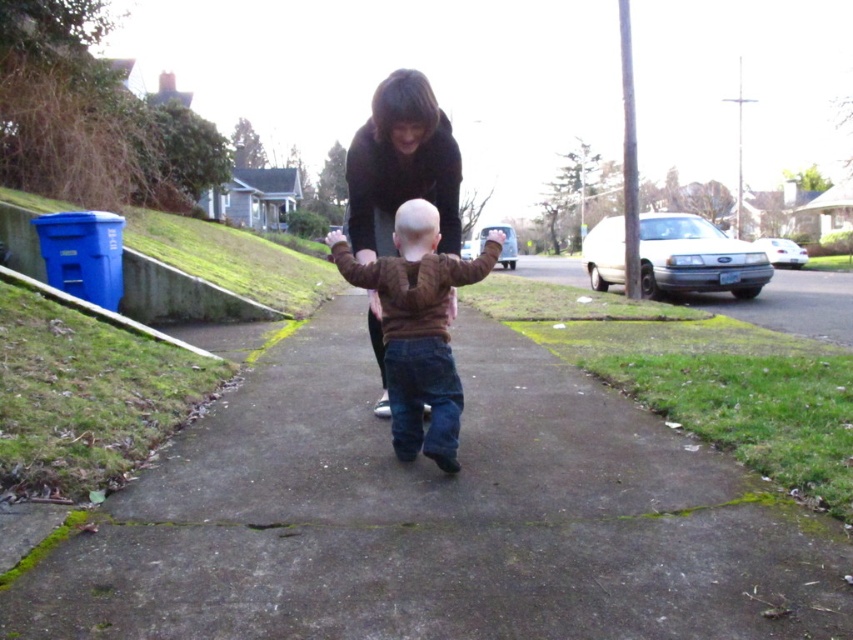
Question: Is brown fuzzy sweater at center further to the viewer compared to dark brown sweater at center?

Choices:
 (A) yes
 (B) no

Answer: (B)

Question: Which point is closer to the camera?

Choices:
 (A) brown fuzzy sweater at center
 (B) dark brown sweater at center
 (C) concrete at center

Answer: (C)

Question: Is concrete at center bigger than dark brown sweater at center?

Choices:
 (A) yes
 (B) no

Answer: (A)

Question: Which point appears farthest from the camera in this image?

Choices:
 (A) (459, 390)
 (B) (450, 225)

Answer: (B)

Question: In this image, where is concrete at center located relative to brown fuzzy sweater at center?

Choices:
 (A) above
 (B) below

Answer: (B)

Question: Estimate the real-world distances between objects in this image. Which object is farther from the brown fuzzy sweater at center?

Choices:
 (A) dark brown sweater at center
 (B) concrete at center

Answer: (B)